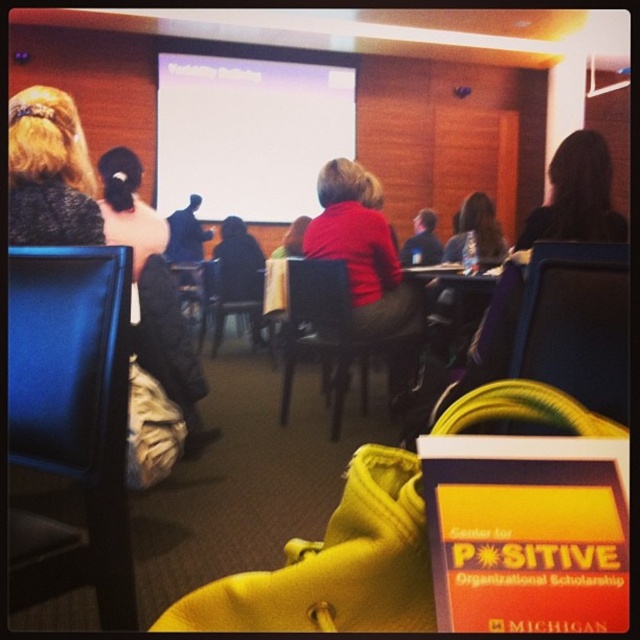
Question: Is black leather chair at center smaller than blonde hair at upper left?

Choices:
 (A) no
 (B) yes

Answer: (B)

Question: Does white matte projection screen at upper center lie in front of matte red sweater at center?

Choices:
 (A) no
 (B) yes

Answer: (A)

Question: Considering the real-world distances, which object is farthest from the blue leather chair at left?

Choices:
 (A) matte black chair at center
 (B) wooden chair at center
 (C) matte red sweater at center
 (D) black leather chair at center

Answer: (A)

Question: Which object appears closest to the camera in this image?

Choices:
 (A) wooden chair at center
 (B) blue leather chair at left

Answer: (B)

Question: Can you confirm if white matte projection screen at upper center is positioned to the left of matte red sweater at center?

Choices:
 (A) no
 (B) yes

Answer: (B)

Question: Estimate the real-world distances between objects in this image. Which object is farther from the matte black chair at center?

Choices:
 (A) blue leather chair at left
 (B) black leather chair at center
 (C) matte red sweater at center
 (D) blonde hair at upper left

Answer: (B)